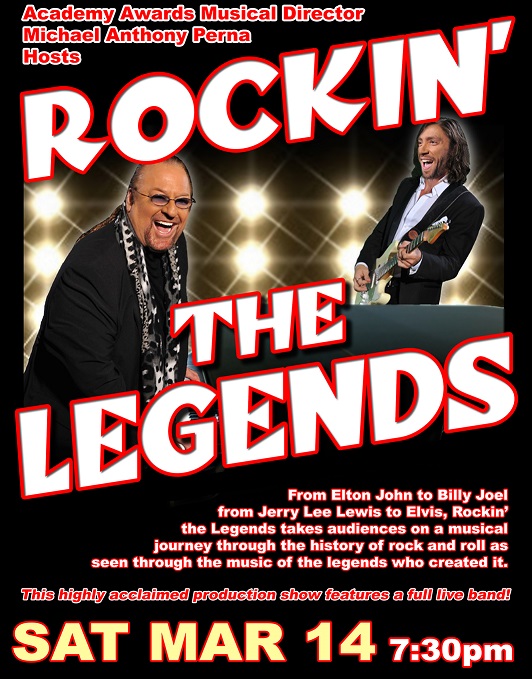
Identify the location of keyboard. Image resolution: width=532 pixels, height=679 pixels. (187, 415).